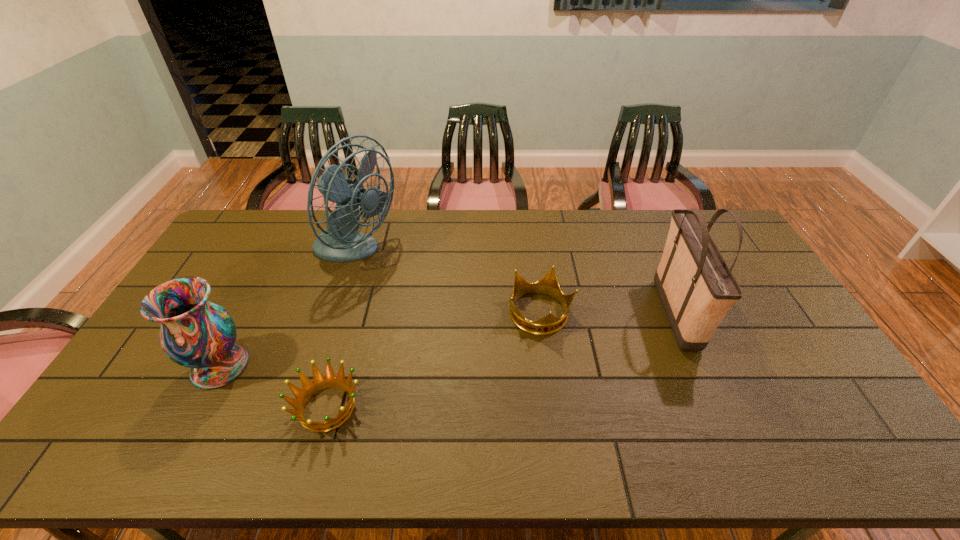
Locate an element on the screen. The width and height of the screenshot is (960, 540). fan is located at coordinates point(340,242).

This screenshot has width=960, height=540. Find the location of `the rightmost object`. the rightmost object is located at coordinates (696, 287).

I want to click on shopping bag, so click(696, 287).

Find the location of `the leftmost object`. the leftmost object is located at coordinates (195, 333).

Identify the location of vase. (195, 333).

Where is `the second object from right to left`? This screenshot has width=960, height=540. the second object from right to left is located at coordinates (548, 285).

The image size is (960, 540). Identify the location of the second shortest object. (548, 285).

You are a GUI agent. You are given a task and a screenshot of the screen. Output one action in this format:
    pyautogui.click(x=<x>, y=<y>)
    Task: Click on the shorter crown
    This screenshot has width=960, height=540.
    Given the screenshot: What is the action you would take?
    pyautogui.click(x=319, y=383)

Find the location of a particular element. the left crown is located at coordinates (319, 383).

At what (x,y) coordinates should I click in order to perform the action: click on vacant space located in front of the tallest object to blow air. Please return your answer as a coordinate pair (x, y). This screenshot has width=960, height=540. Looking at the image, I should click on (463, 253).